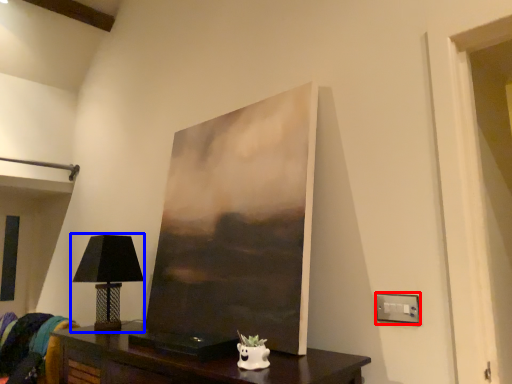
Question: Which object is further to the camera taking this photo, electric outlet (highlighted by a red box) or table lamp (highlighted by a blue box)?

Choices:
 (A) electric outlet
 (B) table lamp

Answer: (B)